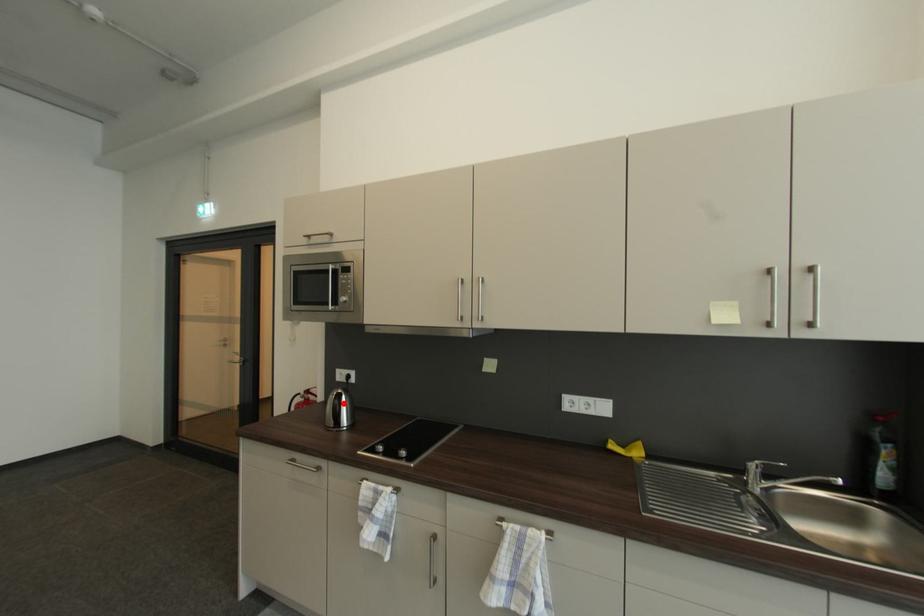
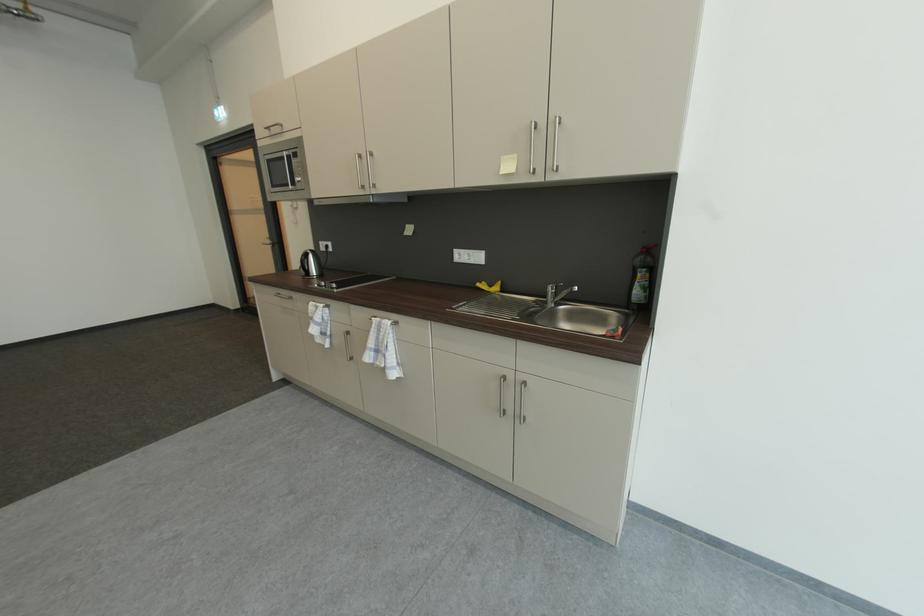
Question: A red point is marked in image1. In image2, is the corresponding 3D point closer to the camera or farther? Reply with the corresponding letter.

Choices:
 (A) The corresponding 3D point is closer.
 (B) The corresponding 3D point is farther.

Answer: (A)